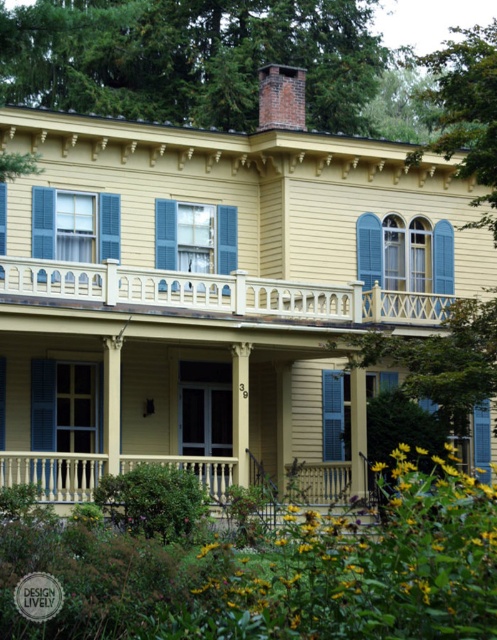
Question: Does yellow wood railing at upper center appear on the left side of blue painted wood shutter at center?

Choices:
 (A) yes
 (B) no

Answer: (A)

Question: Does yellow wood railing at upper center have a smaller size compared to blue painted wood shutter at center?

Choices:
 (A) no
 (B) yes

Answer: (A)

Question: Which point appears closest to the camera in this image?

Choices:
 (A) coord(337,392)
 (B) coord(326,285)

Answer: (B)

Question: Which point is closer to the camera?

Choices:
 (A) (109, 307)
 (B) (324, 380)

Answer: (A)

Question: Is yellow wood railing at upper center to the right of blue painted wood shutter at center from the viewer's perspective?

Choices:
 (A) no
 (B) yes

Answer: (A)